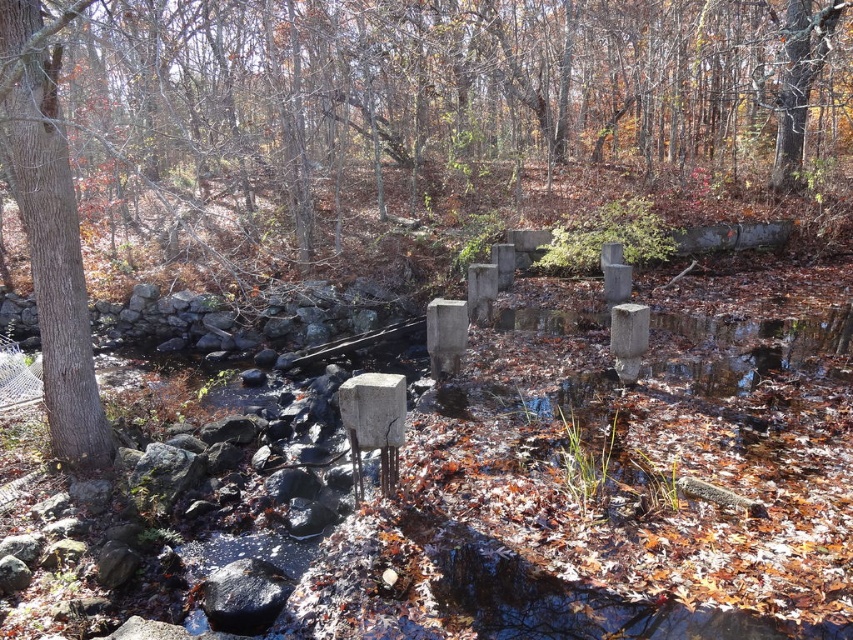
Question: Does brown rough tree trunk at center-left appear on the right side of brown rough tree at left?

Choices:
 (A) no
 (B) yes

Answer: (B)

Question: Estimate the real-world distances between objects in this image. Which object is closer to the brown rough tree at left?

Choices:
 (A) black smooth rock at lower left
 (B) brown rough tree trunk at center-left

Answer: (A)

Question: Does brown rough tree at left come behind black smooth rock at lower left?

Choices:
 (A) no
 (B) yes

Answer: (B)

Question: Considering the real-world distances, which object is farthest from the brown rough tree trunk at center-left?

Choices:
 (A) black smooth rock at lower left
 (B) brown rough tree at left

Answer: (B)

Question: Which object is positioned closest to the black smooth rock at lower left?

Choices:
 (A) brown rough tree at left
 (B) brown rough tree trunk at center-left

Answer: (A)

Question: Can you confirm if brown rough tree trunk at center-left is bigger than brown rough tree at left?

Choices:
 (A) yes
 (B) no

Answer: (A)